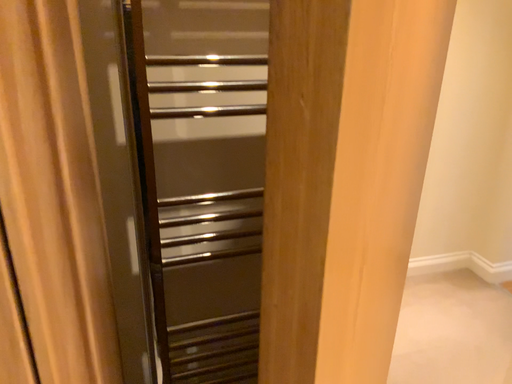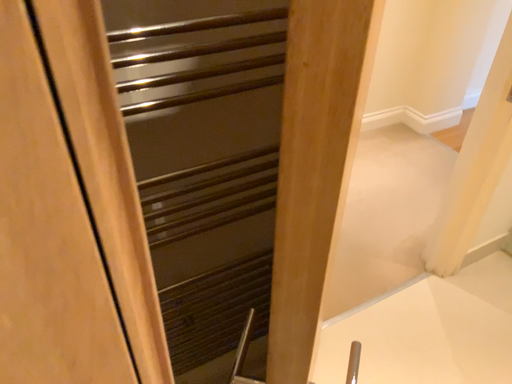
Question: How did the camera likely rotate when shooting the video?

Choices:
 (A) rotated right
 (B) rotated left

Answer: (A)